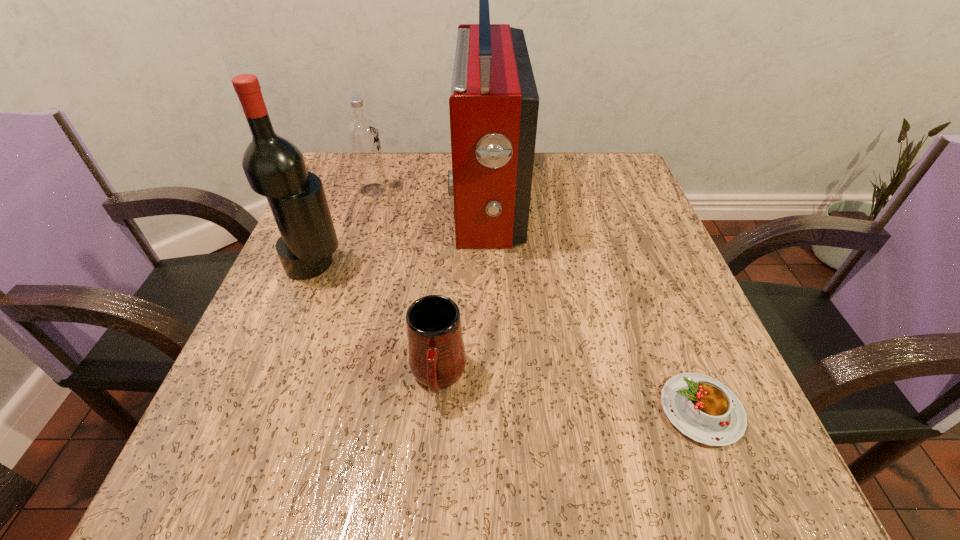
At what (x,y) coordinates should I click in order to perform the action: click on free space located 0.390m on the front label of the third tallest object. Please return your answer as a coordinate pair (x, y). This screenshot has height=540, width=960. Looking at the image, I should click on (556, 190).

The image size is (960, 540). In order to click on vacant space located 0.050m on the side of the fourth tallest object with the handle in this screenshot , I will do `click(433, 444)`.

Identify the location of free space located 0.320m on the left of the shortest object. The width and height of the screenshot is (960, 540). (434, 410).

You are a GUI agent. You are given a task and a screenshot of the screen. Output one action in this format:
    pyautogui.click(x=<x>, y=<y>)
    Task: Click on the radio receiver located in the far edge section of the desktop
    The width and height of the screenshot is (960, 540).
    Given the screenshot: What is the action you would take?
    pyautogui.click(x=493, y=105)

Find the location of `vodka that is at the far edge`. vodka that is at the far edge is located at coordinates pyautogui.click(x=362, y=134).

The height and width of the screenshot is (540, 960). I want to click on object situated at the near edge, so 702,408.

Find the location of a particular element. wine bottle present at the left edge is located at coordinates (274, 167).

Find the location of a particular element. vodka that is at the left edge is located at coordinates (362, 134).

At what (x,y) coordinates should I click in order to perform the action: click on object at the right edge. Please return your answer as a coordinate pair (x, y). This screenshot has width=960, height=540. Looking at the image, I should click on (702, 408).

Image resolution: width=960 pixels, height=540 pixels. Identify the location of object that is at the far left corner. (362, 134).